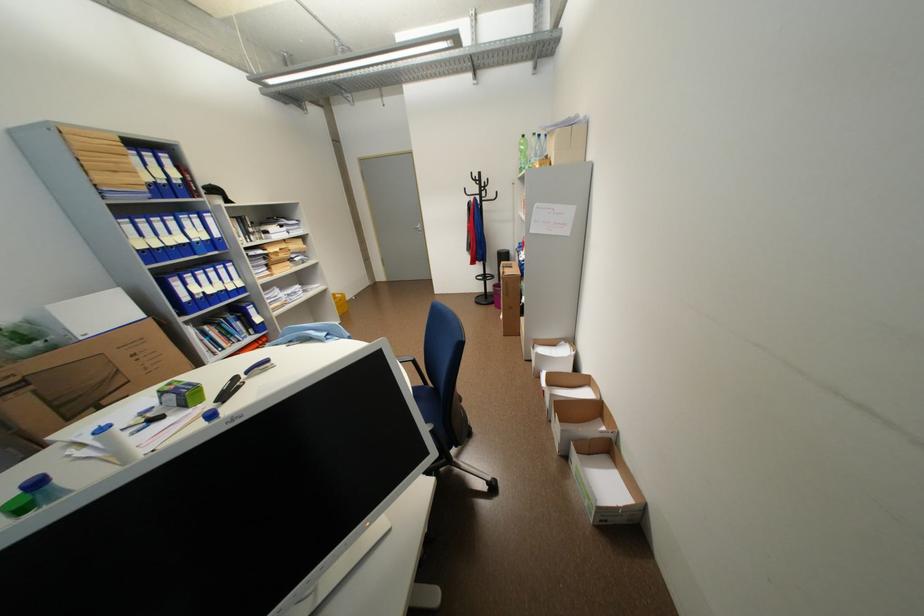
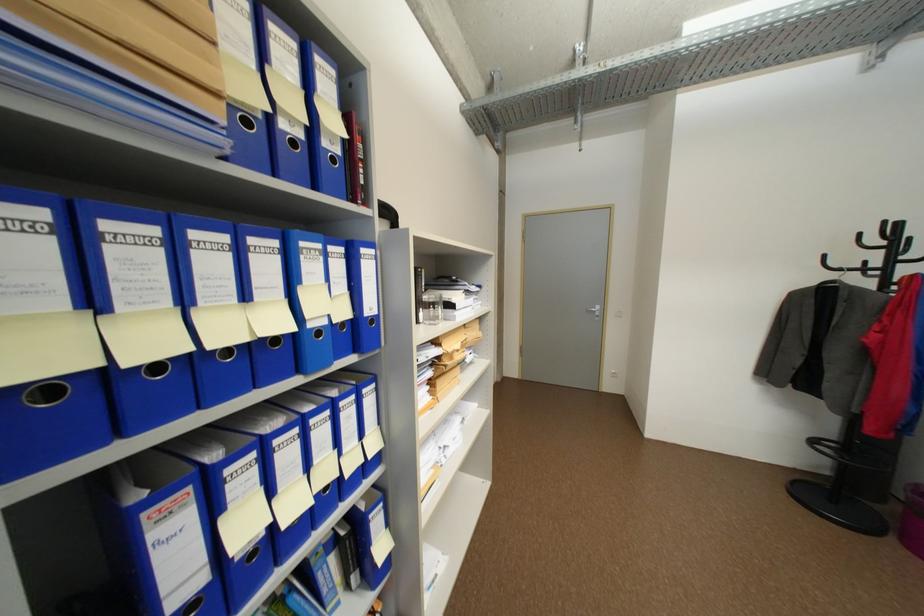
Locate, in the second image, the point that corresponds to point (488, 185) in the first image.

(902, 248)